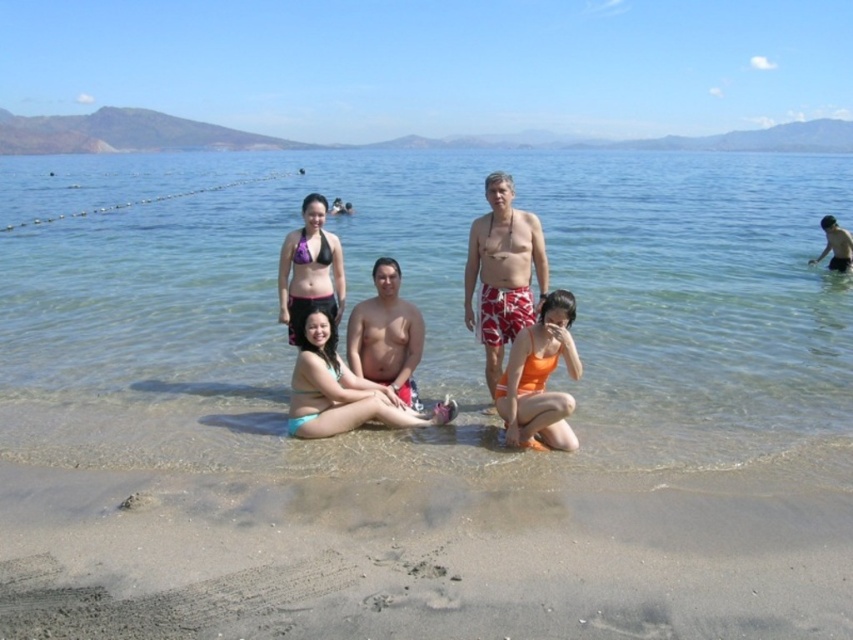
Does sandy beach at lower center appear on the left side of matte black bikini top at center?

Correct, you'll find sandy beach at lower center to the left of matte black bikini top at center.

Describe the element at coordinates (418, 529) in the screenshot. I see `sandy beach at lower center` at that location.

Locate an element on the screen. sandy beach at lower center is located at coordinates (418, 529).

Does teal bikini bottom at center appear over purple matte bikini top at center?

Incorrect, teal bikini bottom at center is not positioned above purple matte bikini top at center.

Can you confirm if teal bikini bottom at center is wider than purple matte bikini top at center?

Yes.

The height and width of the screenshot is (640, 853). What are the coordinates of `teal bikini bottom at center` in the screenshot? It's located at (341, 388).

What are the coordinates of `teal bikini bottom at center` in the screenshot? It's located at (341, 388).

Does clear water at center have a greater height compared to matte black bikini top at center?

Yes.

Is point (622, 324) less distant than point (476, 312)?

No, it is not.

Find the location of a particular element. The image size is (853, 640). clear water at center is located at coordinates [422, 300].